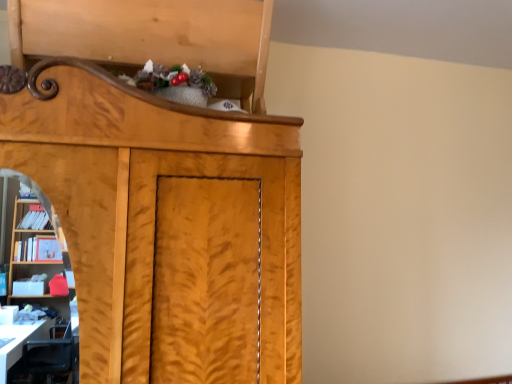
Find the location of `wooden cupboard at upper center`. wooden cupboard at upper center is located at coordinates (164, 190).

Describe the element at coordinates (164, 190) in the screenshot. The image size is (512, 384). I see `wooden cupboard at upper center` at that location.

At what (x,y) coordinates should I click in order to perform the action: click on wooden cupboard at upper center. Please return your answer as a coordinate pair (x, y). The image size is (512, 384). Looking at the image, I should click on (164, 190).